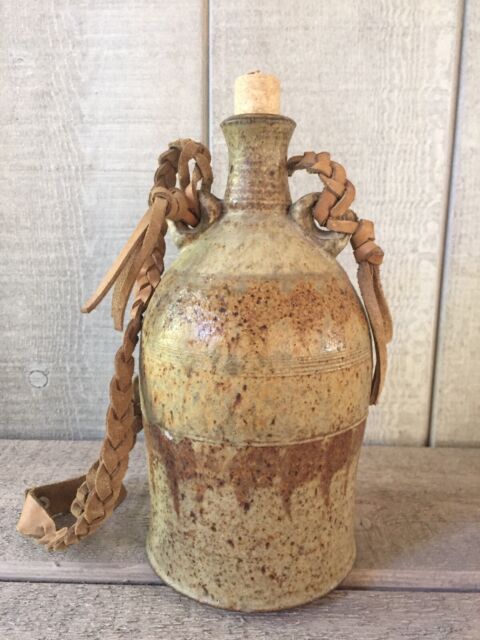
Where is `floor`? floor is located at coordinates (415, 546).